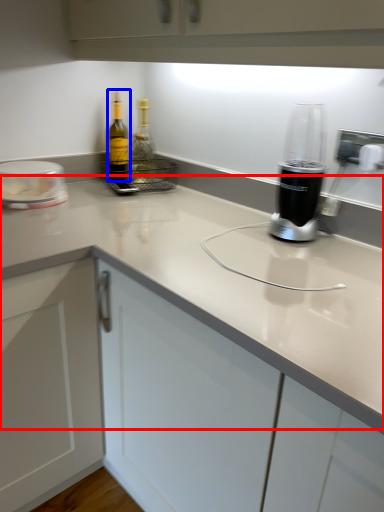
Question: Which of the following is the farthest to the observer, counter top (highlighted by a red box) or bottle (highlighted by a blue box)?

Choices:
 (A) counter top
 (B) bottle

Answer: (B)